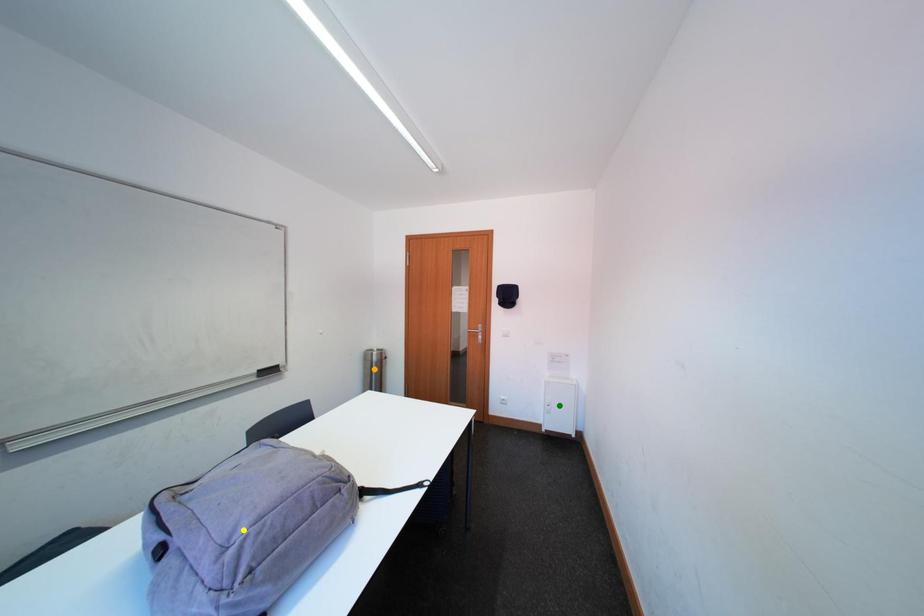
Order these from nearest to farthest:
1. orange point
2. yellow point
3. green point

orange point < green point < yellow point